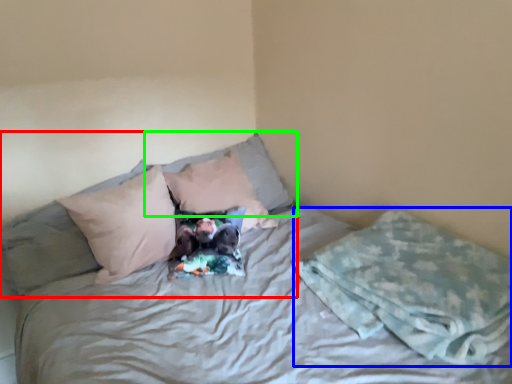
Question: Which object is the farthest from pillow (highlighted by a red box)? Choose among these: blanket (highlighted by a blue box) or pillow (highlighted by a green box).

Choices:
 (A) blanket
 (B) pillow

Answer: (A)